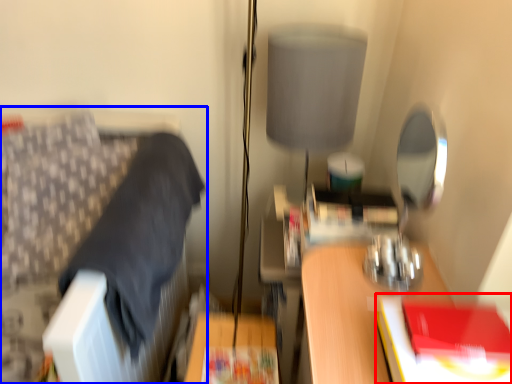
Question: Which object is further to the camera taking this photo, paperback book (highlighted by a red box) or furniture (highlighted by a blue box)?

Choices:
 (A) paperback book
 (B) furniture

Answer: (B)